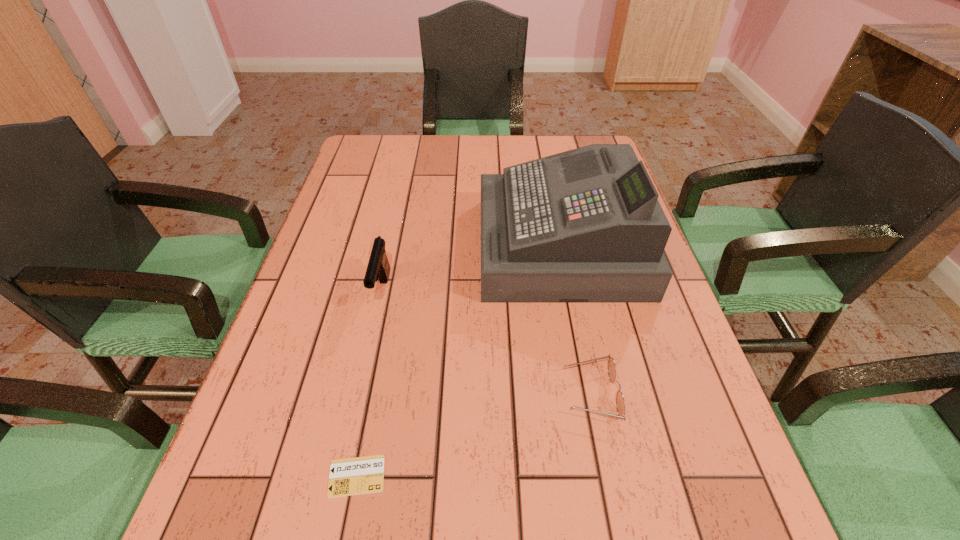
The image size is (960, 540). What are the coordinates of `vacant area that lies between the third shortest object and the identity card` in the screenshot? It's located at (370, 384).

Locate which object ranks second in proximity to the third farthest object. Please provide its 2D coordinates. Your answer should be formatted as a tuple, i.e. [(x, y)], where the tuple contains the x and y coordinates of a point satisfying the conditions above.

[(362, 475)]

The height and width of the screenshot is (540, 960). In order to click on the third closest object to the shortest object in this screenshot , I will do `click(583, 226)`.

Locate an element on the screen. The image size is (960, 540). free location that satisfies the following two spatial constraints: 1. on the front-facing side of the cash register; 2. on the front side of the identity card is located at coordinates (605, 476).

Identify the location of vacant point that satisfies the following two spatial constraints: 1. on the front-facing side of the tallest object; 2. at the barrel of the pistol. The height and width of the screenshot is (540, 960). (569, 292).

Locate an element on the screen. The height and width of the screenshot is (540, 960). free space in the image that satisfies the following two spatial constraints: 1. on the front-facing side of the spectacles; 2. on the front side of the identity card is located at coordinates (608, 476).

You are a GUI agent. You are given a task and a screenshot of the screen. Output one action in this format:
    pyautogui.click(x=<x>, y=<y>)
    Task: Click on the free spot that satisfies the following two spatial constraints: 1. at the barrel of the pistol; 2. on the left side of the identity card
    The image size is (960, 540).
    Given the screenshot: What is the action you would take?
    pyautogui.click(x=342, y=476)

Image resolution: width=960 pixels, height=540 pixels. I want to click on free space that satisfies the following two spatial constraints: 1. on the front-facing side of the third tallest object; 2. on the front side of the identity card, so pyautogui.click(x=608, y=476).

Where is `vacant space that satisfies the following two spatial constraints: 1. at the barrel of the identity card; 2. on the right side of the pistol`? The image size is (960, 540). vacant space that satisfies the following two spatial constraints: 1. at the barrel of the identity card; 2. on the right side of the pistol is located at coordinates (342, 476).